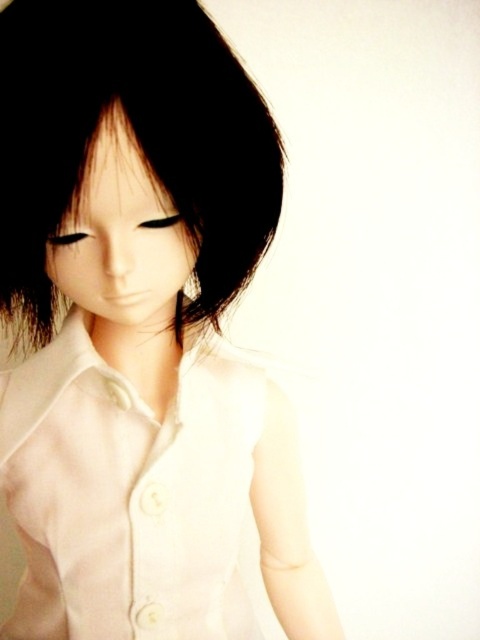
What do you see at coordinates (130, 497) in the screenshot? The height and width of the screenshot is (640, 480). I see `white matte dress shirt at center` at bounding box center [130, 497].

Locate an element on the screen. white matte dress shirt at center is located at coordinates (130, 497).

At what (x,y) coordinates should I click in order to perform the action: click on white matte dress shirt at center. Please return your answer as a coordinate pair (x, y). This screenshot has height=640, width=480. Looking at the image, I should click on (130, 497).

Can you confirm if matte white doll at center is smaller than white matte dress shirt at center?

No.

How distant is matte white doll at center from white matte dress shirt at center?

A distance of 3.74 centimeters exists between matte white doll at center and white matte dress shirt at center.

The image size is (480, 640). Find the location of `matte white doll at center`. matte white doll at center is located at coordinates (140, 330).

At what (x,y) coordinates should I click in order to perform the action: click on matte white doll at center. Please return your answer as a coordinate pair (x, y). Looking at the image, I should click on (140, 330).

Can you confirm if matte white doll at center is positioned to the right of black matte hair at upper center?

In fact, matte white doll at center is to the left of black matte hair at upper center.

In the scene shown: Does matte white doll at center have a smaller size compared to black matte hair at upper center?

No, matte white doll at center is not smaller than black matte hair at upper center.

Who is more distant from viewer, (64, 432) or (151, 125)?

Point (64, 432)

What are the coordinates of `matte white doll at center` in the screenshot? It's located at (140, 330).